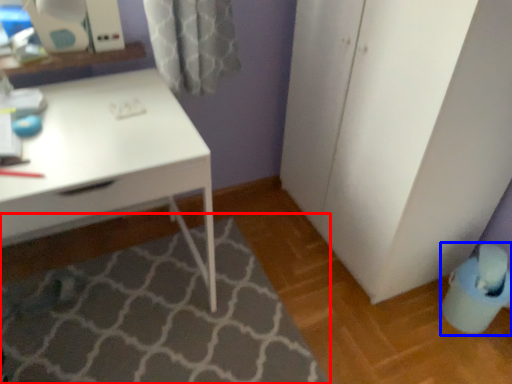
Question: Which of the following is the farthest to the observer, bath mat (highlighted by a red box) or swivel chair (highlighted by a blue box)?

Choices:
 (A) bath mat
 (B) swivel chair

Answer: (B)